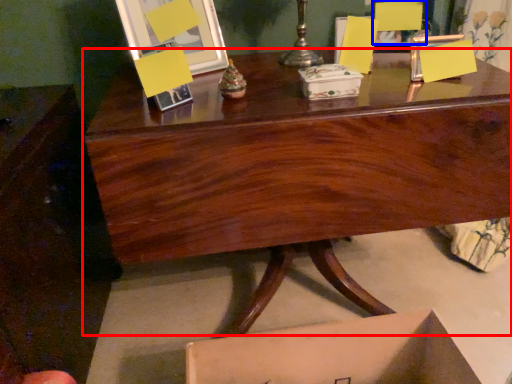
Question: Which point is closer to the camera, desk (highlighted by a red box) or armchair (highlighted by a blue box)?

Choices:
 (A) desk
 (B) armchair

Answer: (A)